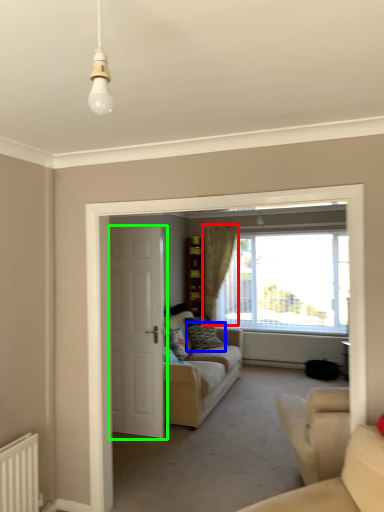
Question: Based on their relative distances, which object is farther from curtain (highlighted by a red box)? Choose from pillow (highlighted by a blue box) and door (highlighted by a green box).

Choices:
 (A) pillow
 (B) door

Answer: (B)